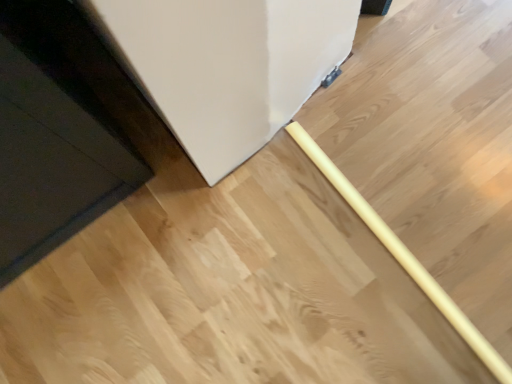
Question: From their relative heights in the image, would you say yellow wood rolling pin at center is taller or shorter than black glossy door at lower left?

Choices:
 (A) short
 (B) tall

Answer: (A)

Question: Relative to black glossy door at lower left, is yellow wood rolling pin at center in front or behind?

Choices:
 (A) front
 (B) behind

Answer: (B)

Question: Choose the correct answer: Is yellow wood rolling pin at center inside black glossy door at lower left or outside it?

Choices:
 (A) outside
 (B) inside

Answer: (A)

Question: Is black glossy door at lower left taller or shorter than yellow wood rolling pin at center?

Choices:
 (A) tall
 (B) short

Answer: (A)

Question: Is black glossy door at lower left spatially inside yellow wood rolling pin at center, or outside of it?

Choices:
 (A) outside
 (B) inside

Answer: (A)

Question: In terms of size, does black glossy door at lower left appear bigger or smaller than yellow wood rolling pin at center?

Choices:
 (A) big
 (B) small

Answer: (A)

Question: From the image's perspective, is black glossy door at lower left located above or below yellow wood rolling pin at center?

Choices:
 (A) below
 (B) above

Answer: (B)